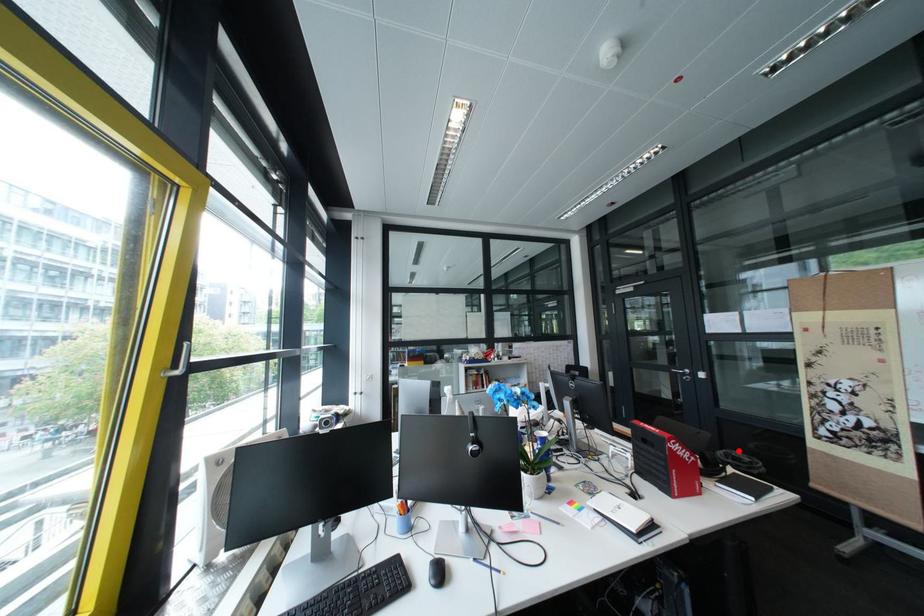
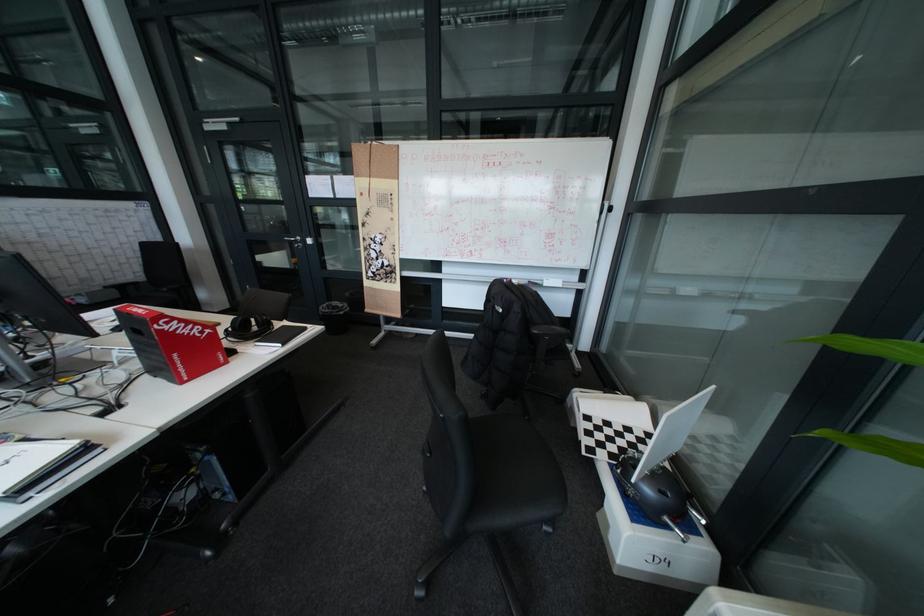
Question: I am providing you with two images of the same scene from different viewpoints. Image1 has a red point marked. In image2, the corresponding 3D location appears at what relative position? Reply with the corresponding letter.

Choices:
 (A) Closer
 (B) Farther

Answer: (B)